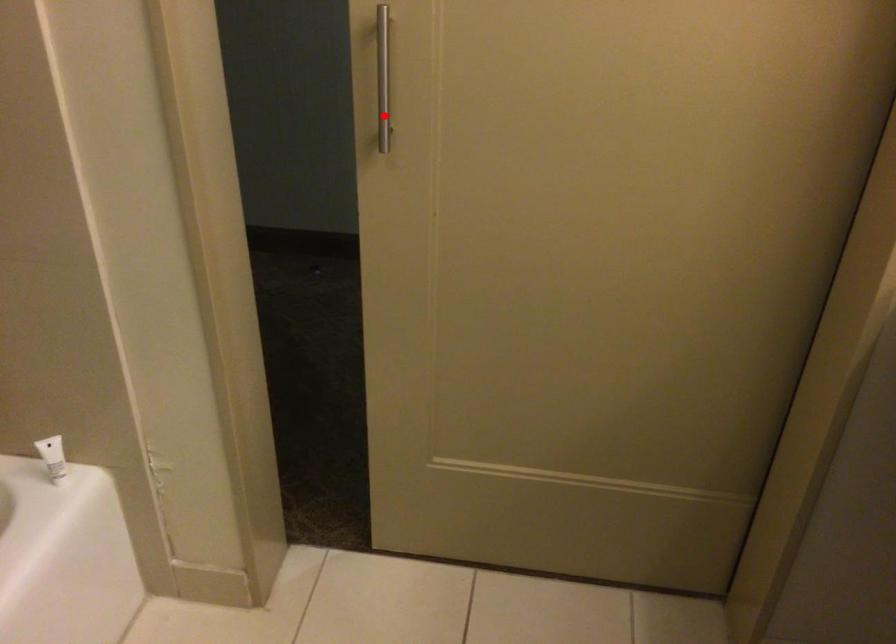
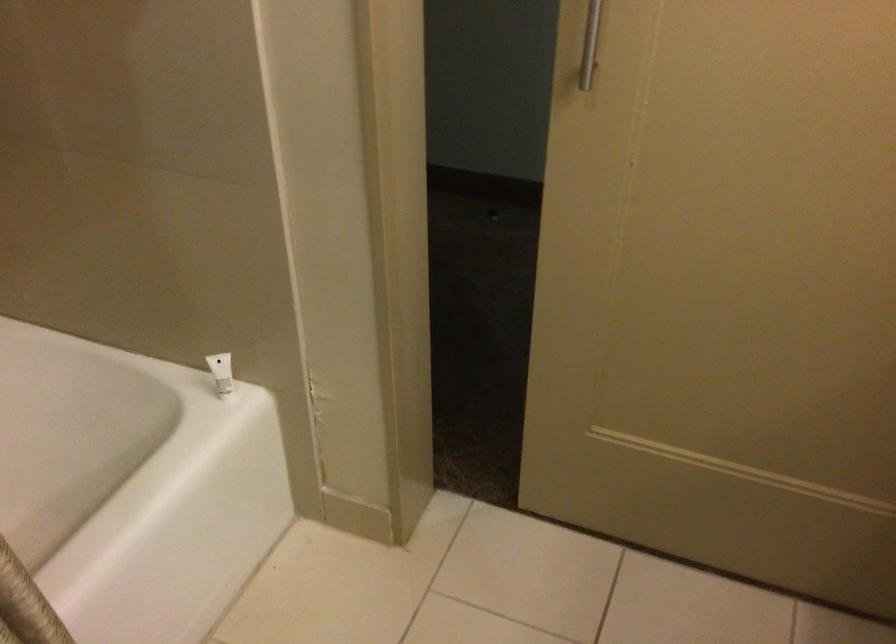
The point at the highlighted location is marked in the first image. Where is the corresponding point in the second image?

(590, 44)